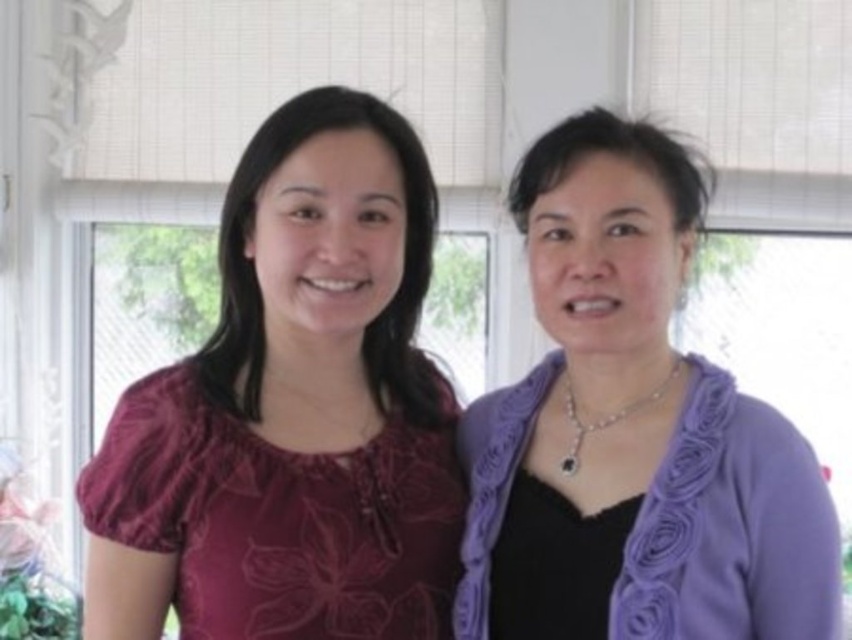
You are designing a new clothing line and want to ensure that the matte floral blouse at center and the purple fabric at right can be displayed together in a store window. Given that the display area has limited space, which of the two items should be placed first to maximize visibility?

The matte floral blouse at center should be placed first because it has a larger size compared to the purple fabric at right, allowing it to be more visible in the display area.

You are standing in the room where the two individuals are. You want to place a small plant exactly at the point marked by the coordinates point (301, 403). What object will the plant be placed on top of?

The small plant will be placed on top of the matte floral blouse at center located at point (301, 403).

Looking at this image, you are organizing a photoshoot and need to ensure the matte floral blouse at center and the purple fabric at right are positioned correctly according to the image. From the photographer perspective, which object is positioned to the left?

The matte floral blouse at center is positioned to the left of the purple fabric at right.